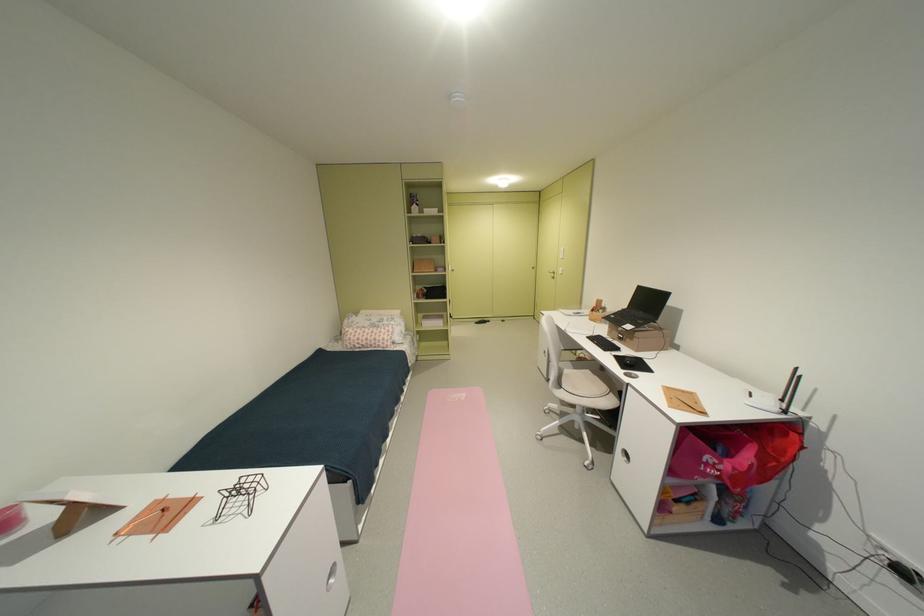
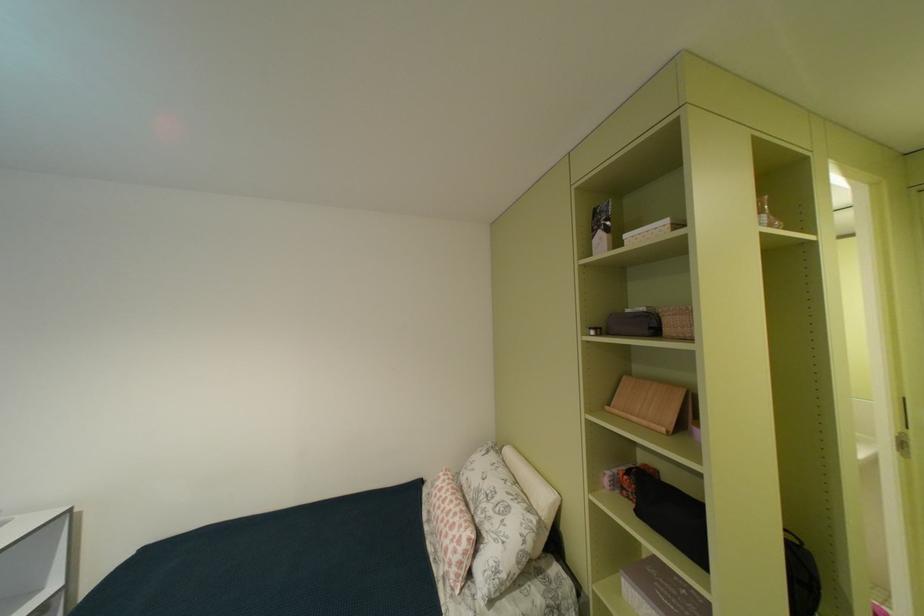
Find the pixel in the second image that matches (x=395, y=339) in the first image.

(458, 556)